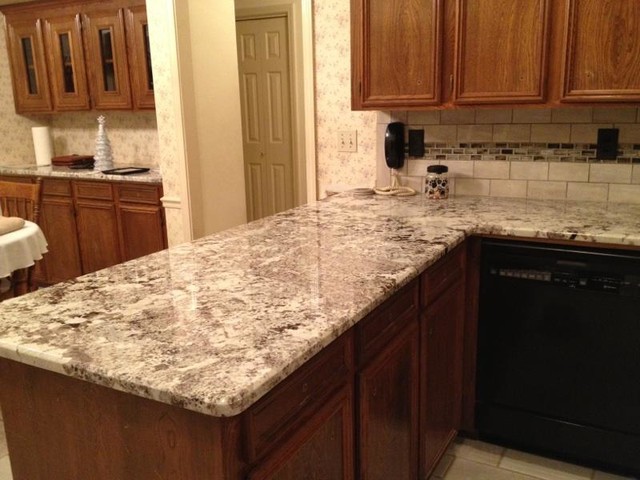
Find the location of `pull to rip off paper towel`. pull to rip off paper towel is located at coordinates (45, 144).